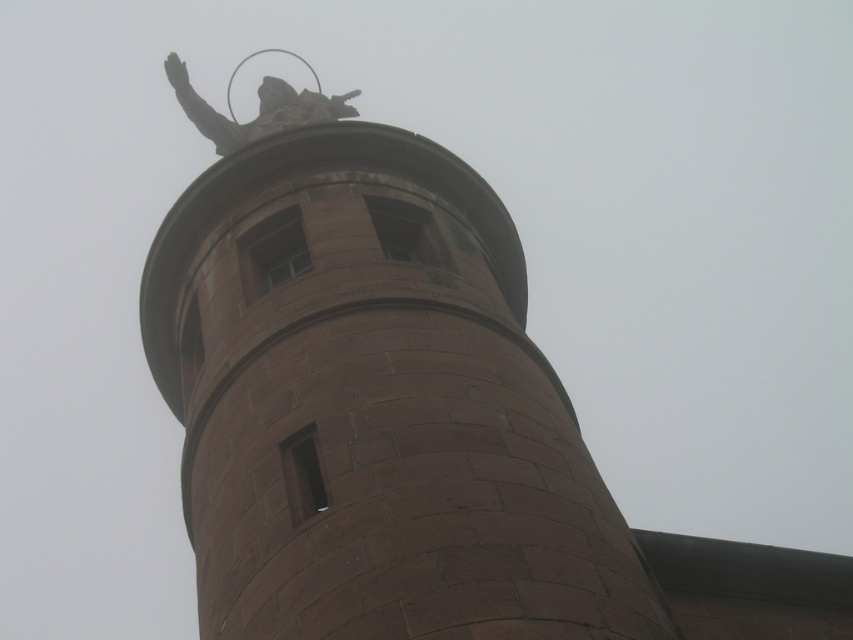
Question: Which point is closer to the camera?

Choices:
 (A) (224, 140)
 (B) (190, 500)

Answer: (B)

Question: Which of the following is the farthest from the observer?

Choices:
 (A) brown stone spire at upper center
 (B) polished bronze statue at upper center

Answer: (B)

Question: Can you confirm if brown stone spire at upper center is bigger than polished bronze statue at upper center?

Choices:
 (A) no
 (B) yes

Answer: (A)

Question: Does brown stone spire at upper center come behind polished bronze statue at upper center?

Choices:
 (A) no
 (B) yes

Answer: (A)

Question: Can you confirm if brown stone spire at upper center is positioned above polished bronze statue at upper center?

Choices:
 (A) yes
 (B) no

Answer: (B)